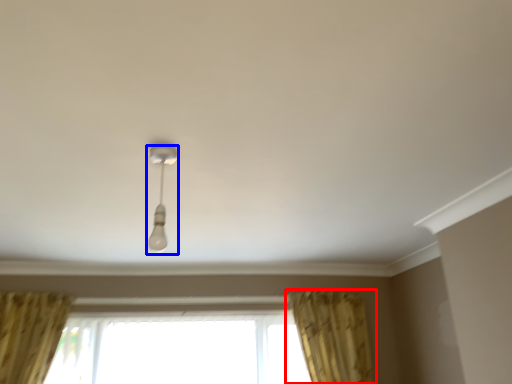
Question: Which object appears closest to the camera in this image, curtain (highlighted by a red box) or lamp (highlighted by a blue box)?

Choices:
 (A) curtain
 (B) lamp

Answer: (B)